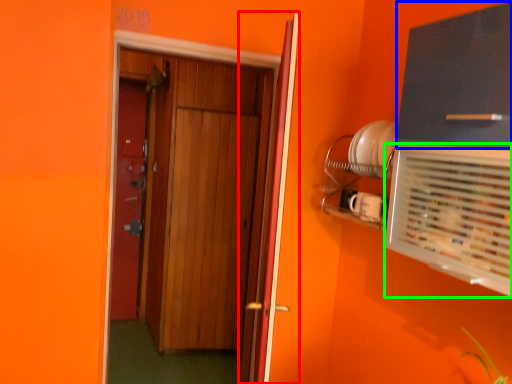
Question: Based on their relative distances, which object is farther from door (highlighted by a red box)? Choose from cabinetry (highlighted by a blue box) and air conditioning (highlighted by a green box).

Choices:
 (A) cabinetry
 (B) air conditioning

Answer: (A)